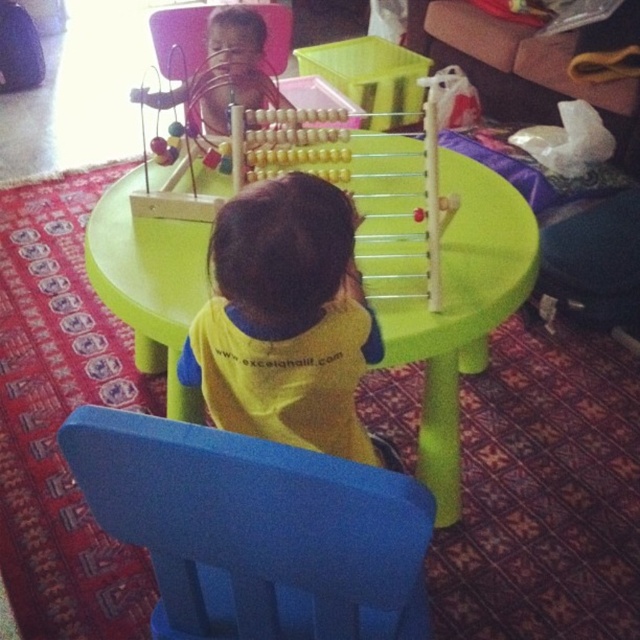
Question: Is blue plastic chair at lower center above green plastic table at center?

Choices:
 (A) no
 (B) yes

Answer: (A)

Question: Is the position of yellow fabric toddler at center less distant than that of wooden beads at center?

Choices:
 (A) no
 (B) yes

Answer: (B)

Question: Which point is farther to the camera?

Choices:
 (A) green plastic table at center
 (B) yellow fabric toddler at center
 (C) wooden beads at center

Answer: (C)

Question: Which point is closer to the camera?

Choices:
 (A) wooden beads at center
 (B) green plastic table at center

Answer: (B)

Question: Which point is closer to the camera taking this photo?

Choices:
 (A) (115, 253)
 (B) (394, 460)
 (C) (218, 513)

Answer: (C)

Question: Does blue plastic chair at lower center appear over green plastic table at center?

Choices:
 (A) no
 (B) yes

Answer: (A)